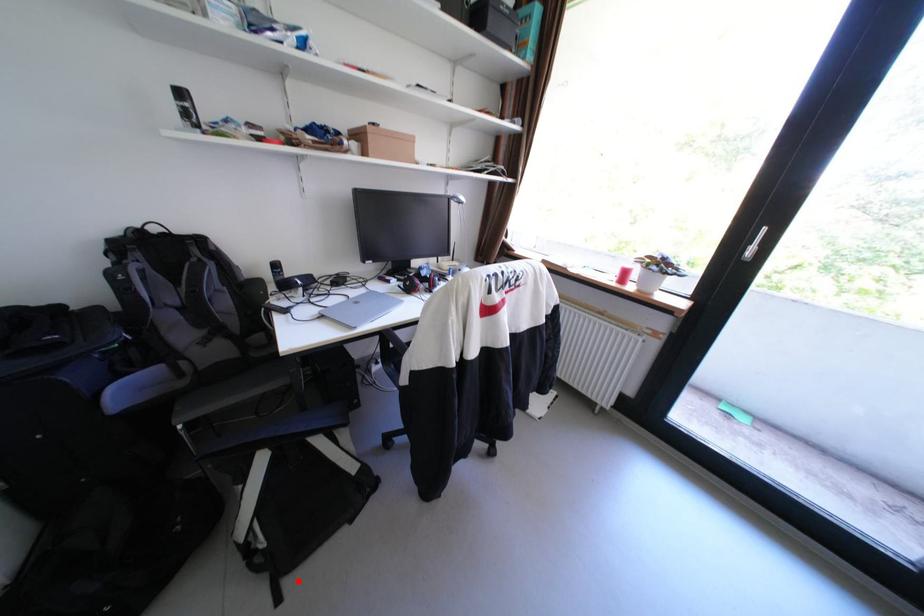
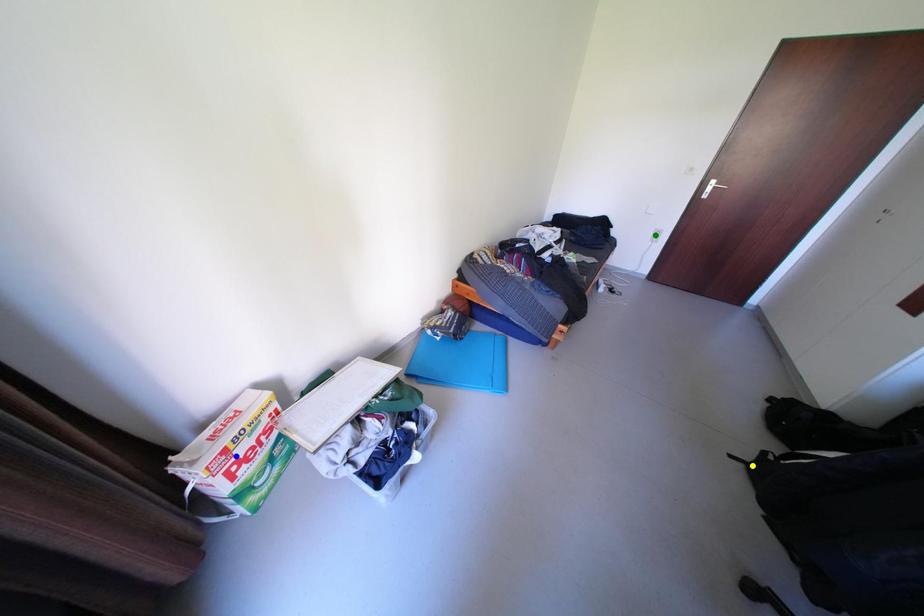
Question: I am providing you with two images of the same scene from different viewpoints. A red point is marked on the first image. You are given multiple points on the second image. Which mark in image 2 goes with the point in image 1?

Choices:
 (A) yellow point
 (B) blue point
 (C) green point

Answer: (A)